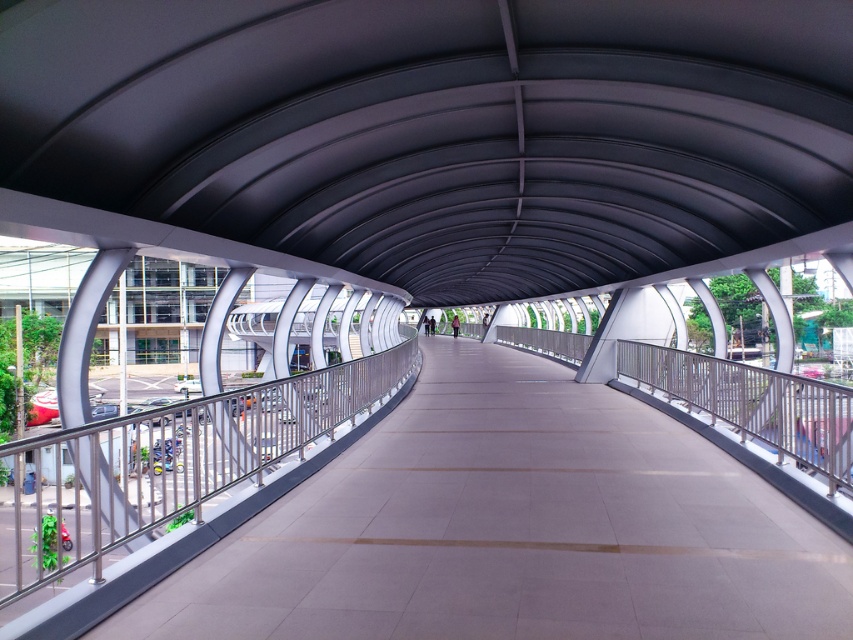
You are standing on the walkway of the modern pedestrian bridge and want to place a small bench for visitors to rest. The bench requires a flat area of 1.2 meters in length. Based on the scene description, can you confirm if the area at point [514,529] is suitable for placing the bench?

The area at point [514,529] is the satin concrete walkway at center, which is described as wide, smooth, and well maintained. Since the walkway is flat and has a smooth surface, it should accommodate the bench requiring 1.2 meters in length.

You are a maintenance worker standing on the satin concrete walkway at center and want to reach the top of the satin silver railing at left. Can you step onto the railing from the walkway without needing a ladder?

The satin concrete walkway at center is not as tall as the satin silver railing at left, so you would need a ladder to reach the top of the satin silver railing at left from the walkway.